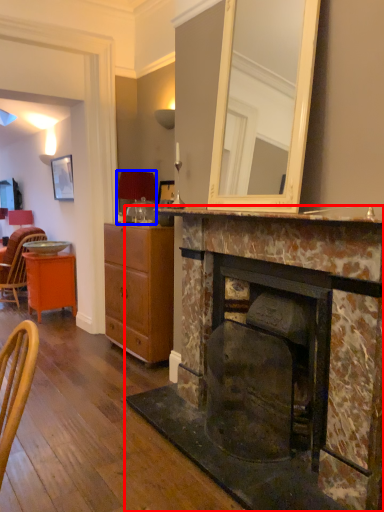
Question: Which object appears farthest to the camera in this image, fireplace (highlighted by a red box) or lamp (highlighted by a blue box)?

Choices:
 (A) fireplace
 (B) lamp

Answer: (B)